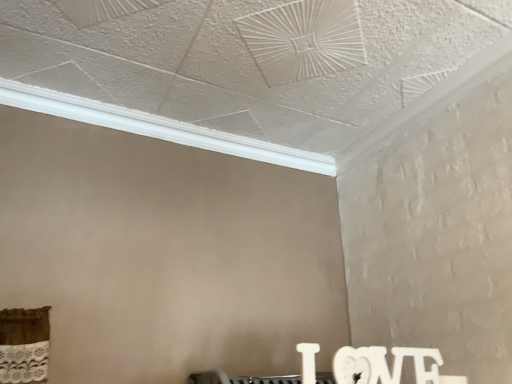
Find the location of a particular element. The image size is (512, 384). white matte wooden letters at lower right is located at coordinates (387, 365).

Image resolution: width=512 pixels, height=384 pixels. Describe the element at coordinates (387, 365) in the screenshot. I see `white matte wooden letters at lower right` at that location.

The height and width of the screenshot is (384, 512). Describe the element at coordinates (159, 127) in the screenshot. I see `white textured crown molding at upper center` at that location.

Where is `white textured crown molding at upper center`? white textured crown molding at upper center is located at coordinates [159, 127].

Locate an element on the screen. This screenshot has width=512, height=384. white matte wooden letters at lower right is located at coordinates (387, 365).

Is white matte wooden letters at lower right to the right of white textured crown molding at upper center from the viewer's perspective?

Indeed, white matte wooden letters at lower right is positioned on the right side of white textured crown molding at upper center.

Consider the image. Considering their positions, is white matte wooden letters at lower right located in front of or behind white textured crown molding at upper center?

Visually, white matte wooden letters at lower right is located in front of white textured crown molding at upper center.

Between point (334, 361) and point (194, 132), which one is positioned behind?

The point (194, 132) is behind.

Looking at this image, from the image's perspective, is white matte wooden letters at lower right on white textured crown molding at upper center?

No, from the image's perspective, white matte wooden letters at lower right is not above white textured crown molding at upper center.

From a real-world perspective, who is located higher, white matte wooden letters at lower right or white textured crown molding at upper center?

From a 3D spatial view, white textured crown molding at upper center is above.

Between white matte wooden letters at lower right and white textured crown molding at upper center, which one has smaller width?

white matte wooden letters at lower right.

Considering the sizes of objects white matte wooden letters at lower right and white textured crown molding at upper center in the image provided, who is shorter, white matte wooden letters at lower right or white textured crown molding at upper center?

white textured crown molding at upper center.

Can you confirm if white matte wooden letters at lower right is bigger than white textured crown molding at upper center?

No.

Is white matte wooden letters at lower right situated inside white textured crown molding at upper center or outside?

white matte wooden letters at lower right lies outside white textured crown molding at upper center.

Is white matte wooden letters at lower right directly adjacent to white textured crown molding at upper center?

white matte wooden letters at lower right is not next to white textured crown molding at upper center, and they're not touching.

Is white matte wooden letters at lower right aimed at white textured crown molding at upper center?

No, white matte wooden letters at lower right is not turned towards white textured crown molding at upper center.

Can you tell me how much white matte wooden letters at lower right and white textured crown molding at upper center differ in facing direction?

The facing directions of white matte wooden letters at lower right and white textured crown molding at upper center are 1.52 degrees apart.

Where is `writing in front of the white textured crown molding at upper center`? writing in front of the white textured crown molding at upper center is located at coordinates (387, 365).

Considering the relative positions of white textured crown molding at upper center and white matte wooden letters at lower right in the image provided, is white textured crown molding at upper center to the left of white matte wooden letters at lower right from the viewer's perspective?

Indeed, white textured crown molding at upper center is positioned on the left side of white matte wooden letters at lower right.

Does white textured crown molding at upper center lie in front of white matte wooden letters at lower right?

No, it is behind white matte wooden letters at lower right.

Which is farther from the camera, (315, 154) or (383, 382)?

The point (315, 154) is more distant.

Based on the photo, from the image's perspective, between white textured crown molding at upper center and white matte wooden letters at lower right, which one is located above?

white textured crown molding at upper center, from the image's perspective.

From a real-world perspective, which object stands above the other?

white textured crown molding at upper center, from a real-world perspective.

Between white textured crown molding at upper center and white matte wooden letters at lower right, which one has larger width?

white textured crown molding at upper center is wider.

Does white textured crown molding at upper center have a greater height compared to white matte wooden letters at lower right?

In fact, white textured crown molding at upper center may be shorter than white matte wooden letters at lower right.

Is white textured crown molding at upper center smaller than white matte wooden letters at lower right?

No.

Is white textured crown molding at upper center located outside white matte wooden letters at lower right?

white textured crown molding at upper center lies outside white matte wooden letters at lower right's area.

Are white textured crown molding at upper center and white matte wooden letters at lower right beside each other?

They are not placed beside each other.

Is white textured crown molding at upper center facing away from white matte wooden letters at lower right?

No, white textured crown molding at upper center is not facing away from white matte wooden letters at lower right.

How much distance is there between white textured crown molding at upper center and white matte wooden letters at lower right?

A distance of 33.28 inches exists between white textured crown molding at upper center and white matte wooden letters at lower right.

The width and height of the screenshot is (512, 384). In order to click on window located above the white matte wooden letters at lower right (from the image's perspective) in this screenshot , I will do `click(159, 127)`.

Identify the location of writing that appears below the white textured crown molding at upper center (from the image's perspective). This screenshot has height=384, width=512. (387, 365).

Identify the location of writing in front of the white textured crown molding at upper center. (387, 365).